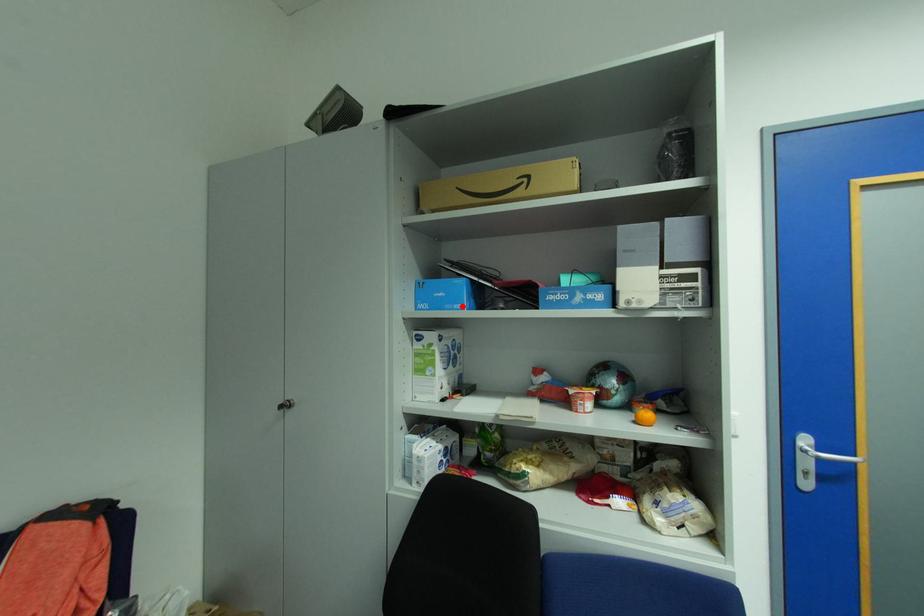
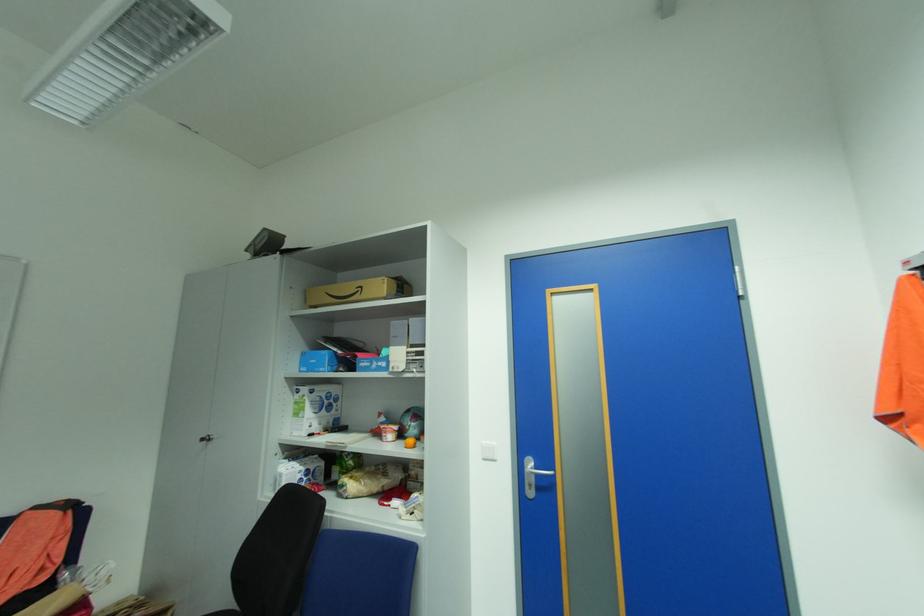
Find the pixel in the second image that matches the highlighted location in the first image.

(327, 370)